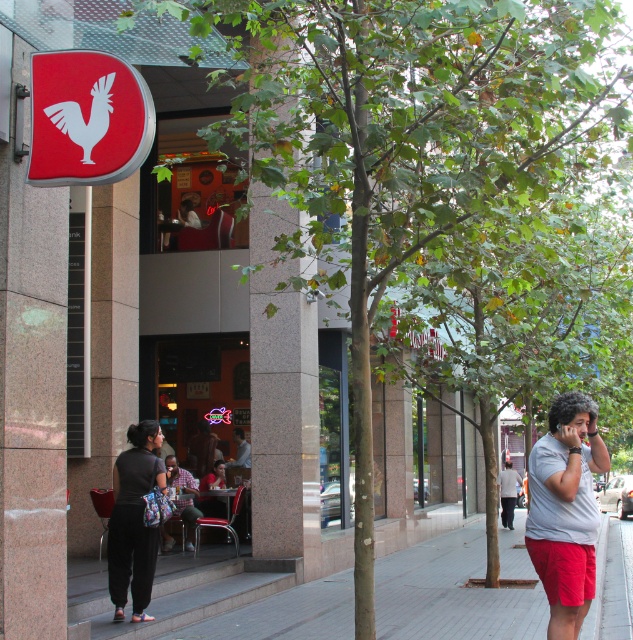
Question: Estimate the real-world distances between objects in this image. Which object is closer to the smooth skin man at center?

Choices:
 (A) plaid shirt at center
 (B) white cotton shirt at right

Answer: (A)

Question: Estimate the real-world distances between objects in this image. Which object is farther from the concrete pavement at lower left?

Choices:
 (A) plaid shirt at center
 (B) white cotton shirt at right
 (C) dark gray fabric pants at lower left

Answer: (B)

Question: Does concrete pavement at lower left have a larger size compared to plaid shirt at center?

Choices:
 (A) yes
 (B) no

Answer: (A)

Question: Which point is closer to the camera?

Choices:
 (A) (134, 481)
 (B) (505, 472)
 (C) (541, 472)

Answer: (C)

Question: Does plaid shirt at center appear under white cotton shirt at right?

Choices:
 (A) yes
 (B) no

Answer: (B)

Question: Does dark gray fabric pants at lower left have a smaller size compared to plaid shirt at center?

Choices:
 (A) yes
 (B) no

Answer: (A)